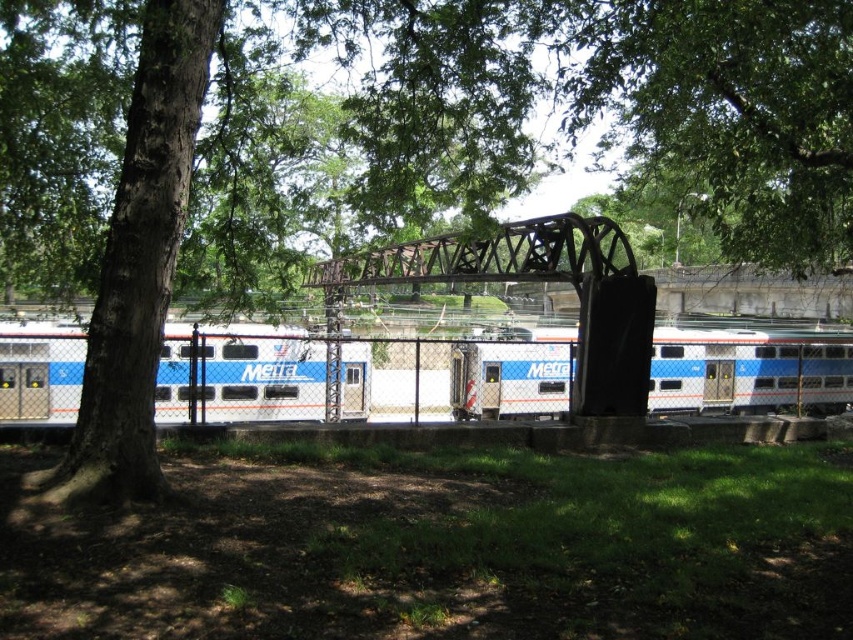
Question: Is blue and white painted passenger train at center further to the viewer compared to rusty metal train bridge at center?

Choices:
 (A) no
 (B) yes

Answer: (B)

Question: Is blue and white painted passenger train at center below silver metallic train at left?

Choices:
 (A) yes
 (B) no

Answer: (A)

Question: Does blue and white painted passenger train at center appear on the right side of silver metallic train at left?

Choices:
 (A) yes
 (B) no

Answer: (A)

Question: Which point is farther to the camera?

Choices:
 (A) (508, 349)
 (B) (305, 349)
 (C) (595, 240)

Answer: (A)

Question: Which of the following is the farthest from the observer?

Choices:
 (A) rusty metal train bridge at center
 (B) silver metallic train at left

Answer: (A)

Question: Which point is farther from the camera taking this photo?

Choices:
 (A) (585, 228)
 (B) (242, 404)
 (C) (308, 381)

Answer: (C)